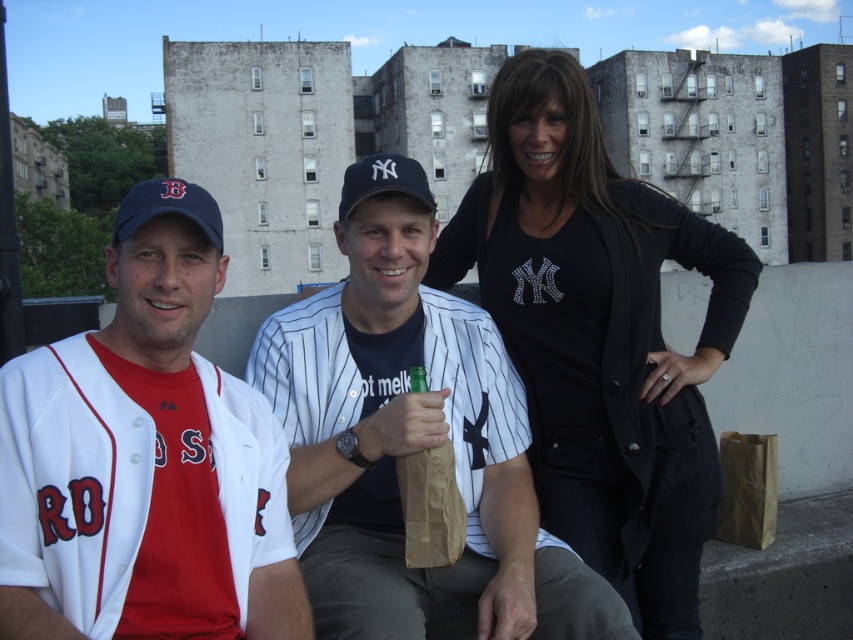
You are standing at the point labeled point (471,324) and want to move towards the point labeled point (738,506). Which direction should you move to get closer to the second point?

You should move towards the point labeled point (738,506) because it is further away from you compared to the first point.

You are standing at the edge of the rooftop looking at the white pinstriped jersey at center and the brown paper bag at lower right. Which object is higher from the ground?

The white pinstriped jersey at center is located above the brown paper bag at lower right, so it is higher from the ground.